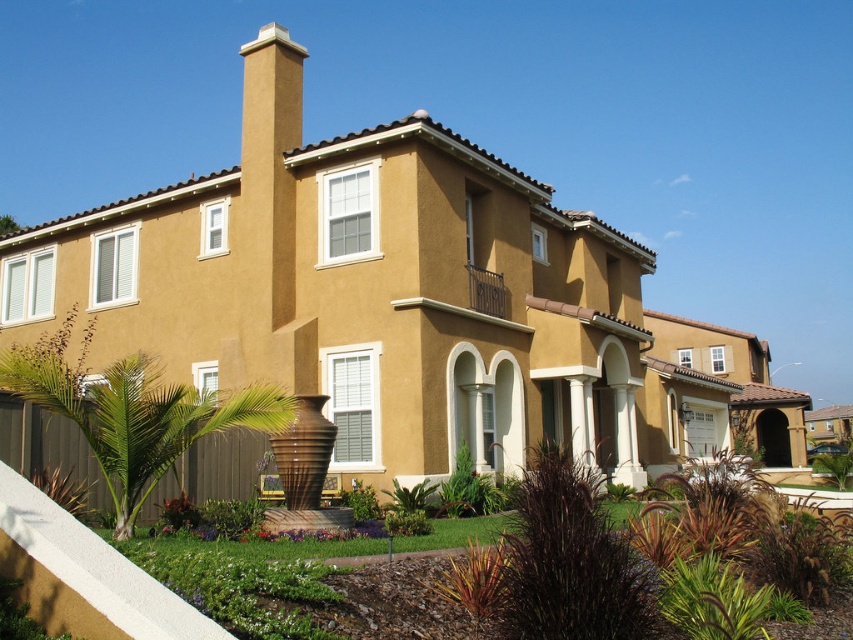
You are standing at the entrance of the house and want to see both the green leafy plant at center and the green leafy bush at center. Which one is closer to you?

The green leafy plant at center is closer to you because the green leafy bush at center is behind it.

You are standing in front of the house and want to take a photo. There are two points on the house that you need to focus on. The first point is at coordinate point [47,353] and the second is at coordinate point [360,520]. Which point should you focus on first to ensure both are in the frame?

You should focus on point [47,353] first because it is closer to the camera than point [360,520]. This ensures both points remain within the frame as you adjust the focus.

You are a gardener planning to place a new decorative pot that requires at least 2 meters of space. You see the green leafy palm tree at lower left and the green leafy plant at center. Which one has enough space for the pot?

The green leafy palm tree at lower left has a larger width than the green leafy plant at center, so it likely provides enough space for the 2 meter requirement.